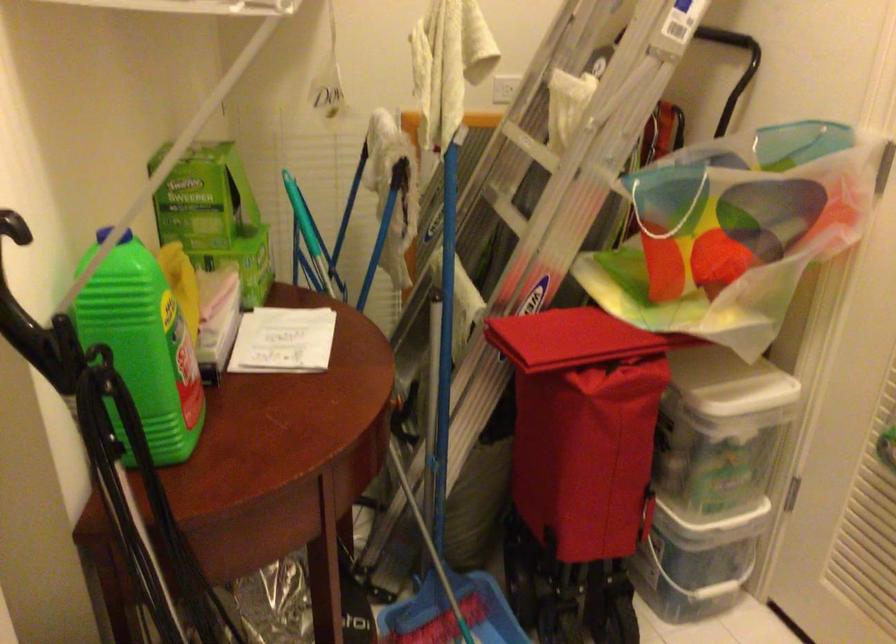
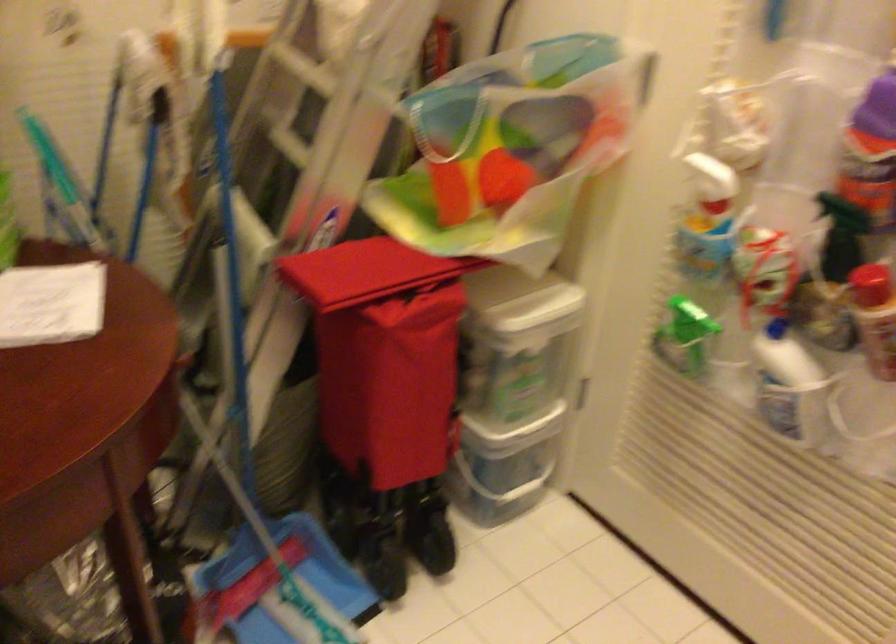
Question: Based on the continuous images, in which direction is the camera rotating? Reply with the corresponding letter.

Choices:
 (A) Left
 (B) Right
 (C) Up
 (D) Down

Answer: (B)